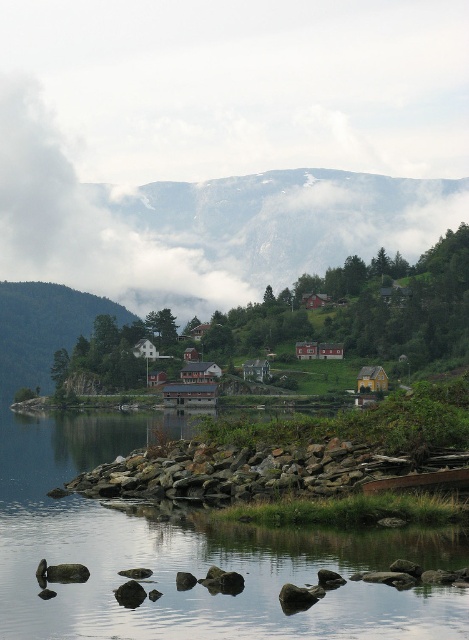
You are standing at the lakeside and want to reach the green grassy hillside at left. Which direction should you walk from the rocky shore at lower center to get there?

You should walk towards the left from the rocky shore at lower center to reach the green grassy hillside at left since it is located above the rocky shore at lower center.

Consider the image. You are an artist painting this lakeside scene. You want to show depth by placing the rocky gray mountain at upper center and green grassy hillside at left in the correct layers. Which object should be painted closer to the front of the canvas?

The rocky gray mountain at upper center should be painted closer to the front of the canvas because it is further to the viewer than the green grassy hillside at left.

You are standing at the point labeled as point (267, 472) in the image, which is the rocky shore at lower center. You want to walk towards the cluster of colorful houses in the middle ground. Which direction should you head?

Since the point (267, 472) is the rocky shore at lower center, you should head north towards the cluster of colorful houses in the middle ground.